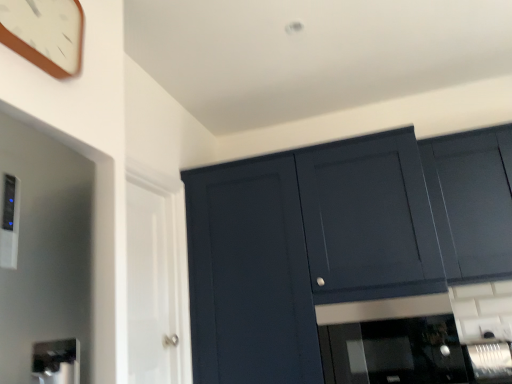
Question: Is white glossy door at left in contact with matte dark blue cabinet at upper right?

Choices:
 (A) yes
 (B) no

Answer: (B)

Question: Does white glossy door at left appear on the right side of matte dark blue cabinet at upper right?

Choices:
 (A) no
 (B) yes

Answer: (A)

Question: Can you confirm if white glossy door at left is positioned to the left of matte dark blue cabinet at upper right?

Choices:
 (A) no
 (B) yes

Answer: (B)

Question: Is white glossy door at left smaller than matte dark blue cabinet at upper right?

Choices:
 (A) yes
 (B) no

Answer: (A)

Question: Is white glossy door at left thinner than matte dark blue cabinet at upper right?

Choices:
 (A) no
 (B) yes

Answer: (B)

Question: Considering the positions of matte dark blue cabinet at upper right and matte dark blue cabinet at upper right in the image, is matte dark blue cabinet at upper right wider or thinner than matte dark blue cabinet at upper right?

Choices:
 (A) wide
 (B) thin

Answer: (A)

Question: From a real-world perspective, is matte dark blue cabinet at upper right physically located above or below matte dark blue cabinet at upper right?

Choices:
 (A) above
 (B) below

Answer: (B)

Question: Does point (202, 173) appear closer or farther from the camera than point (479, 193)?

Choices:
 (A) closer
 (B) farther

Answer: (B)

Question: Do you think matte dark blue cabinet at upper right is within matte dark blue cabinet at upper right, or outside of it?

Choices:
 (A) inside
 (B) outside

Answer: (B)

Question: Choose the correct answer: Is black glass microwave at center, marked as the 2th appliance in a right-to-left arrangement, inside matte dark blue cabinet at upper right or outside it?

Choices:
 (A) inside
 (B) outside

Answer: (B)

Question: From a real-world perspective, is black glass microwave at center, acting as the 1th appliance starting from the left, positioned above or below matte dark blue cabinet at upper right?

Choices:
 (A) above
 (B) below

Answer: (B)

Question: In terms of size, does black glass microwave at center, acting as the 1th appliance starting from the left, appear bigger or smaller than matte dark blue cabinet at upper right?

Choices:
 (A) big
 (B) small

Answer: (B)

Question: Looking at their shapes, would you say black glass microwave at center, acting as the 1th appliance starting from the left, is wider or thinner than matte dark blue cabinet at upper right?

Choices:
 (A) thin
 (B) wide

Answer: (B)

Question: Considering the positions of wooden clock at upper left and matte dark blue cabinet at upper right in the image, is wooden clock at upper left taller or shorter than matte dark blue cabinet at upper right?

Choices:
 (A) short
 (B) tall

Answer: (A)

Question: Is wooden clock at upper left in front of or behind matte dark blue cabinet at upper right in the image?

Choices:
 (A) front
 (B) behind

Answer: (A)